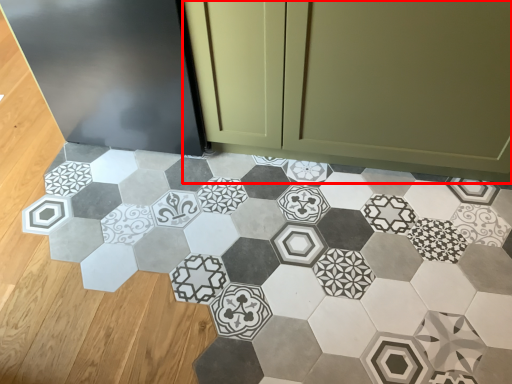
Question: From the image's perspective, where is cabinetry (annotated by the red box) located in relation to ceramic tile in the image?

Choices:
 (A) below
 (B) above

Answer: (B)